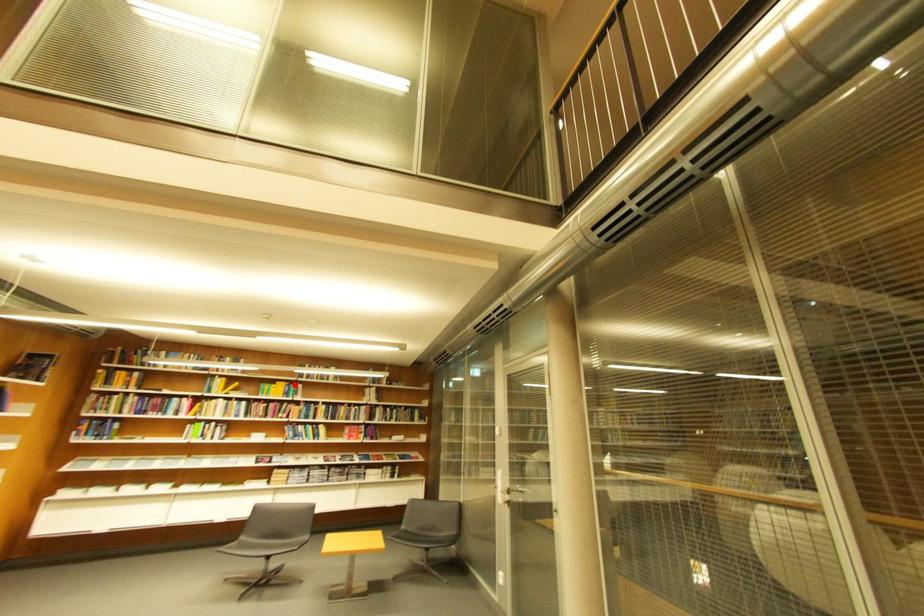
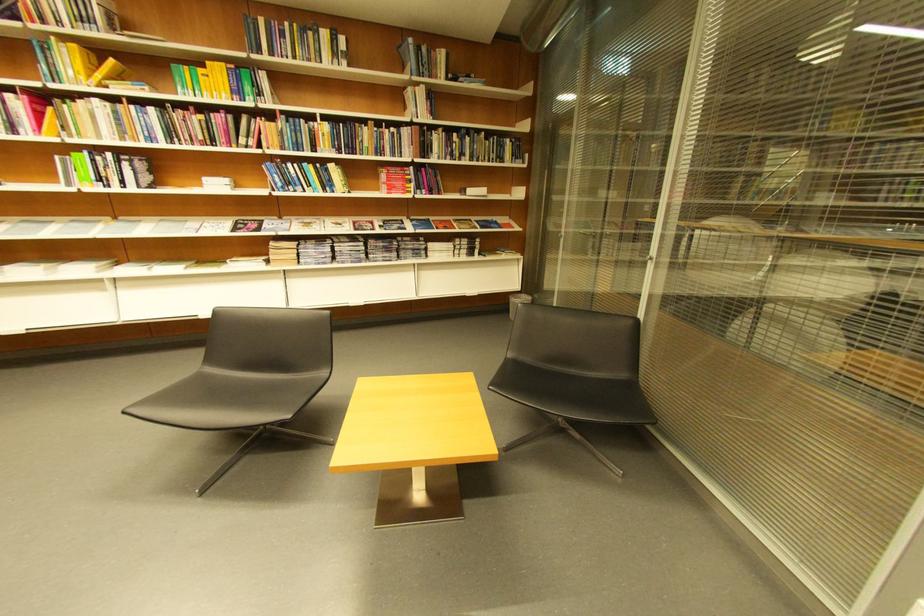
Find the pixel in the second image that matches the highlighted location in the first image.

(234, 66)